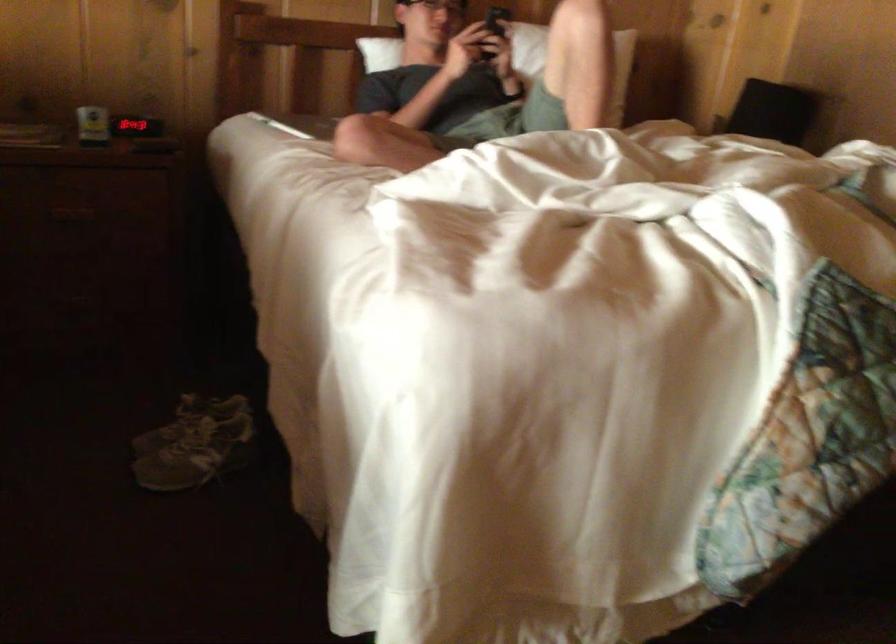
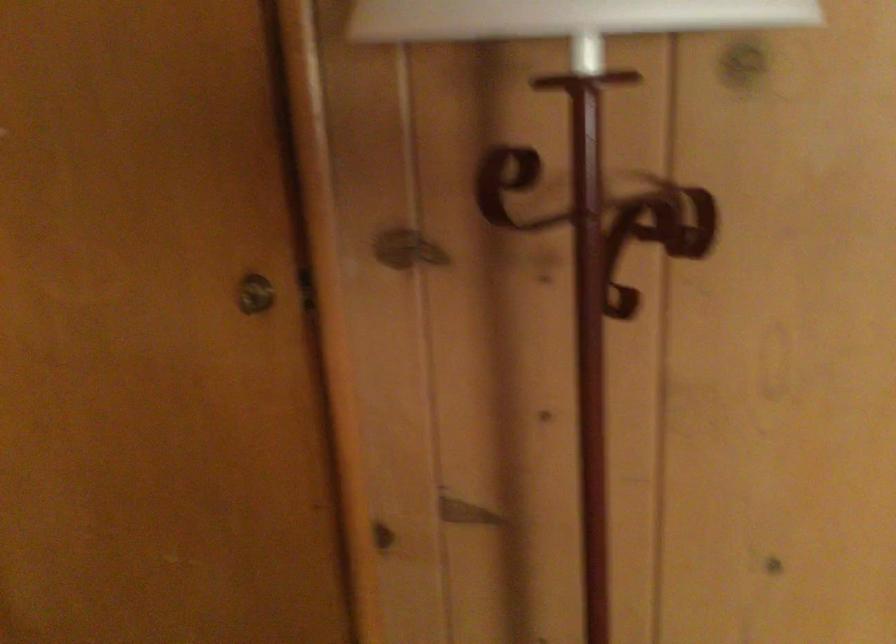
In the scene shown: First-person continuous shooting, in which direction is the camera rotating?

The camera rotated toward right-down.